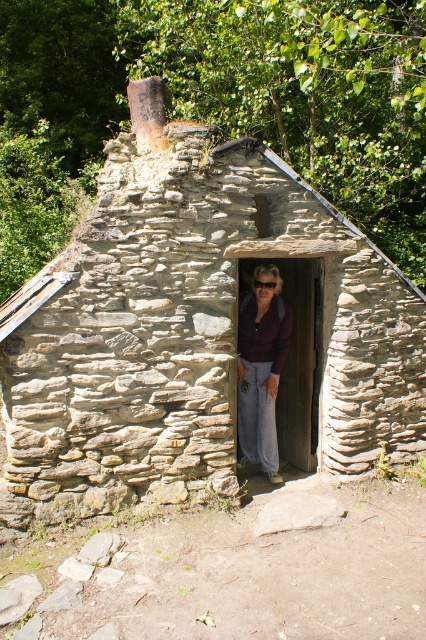
In the scene shown: Is rustic stone cabin at center to the right of matte purple shirt at center from the viewer's perspective?

No, rustic stone cabin at center is not to the right of matte purple shirt at center.

Can you confirm if rustic stone cabin at center is bigger than matte purple shirt at center?

Indeed, rustic stone cabin at center has a larger size compared to matte purple shirt at center.

Between point (196, 474) and point (255, 461), which one is positioned in front?

Point (196, 474) is more forward.

I want to click on rustic stone cabin at center, so click(198, 330).